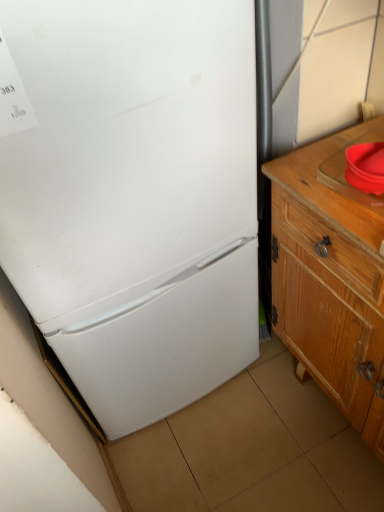
You are a GUI agent. You are given a task and a screenshot of the screen. Output one action in this format:
    pyautogui.click(x=<x>, y=<y>)
    Task: Click on the vacant space situated on the left part of red plastic sink at right
    
    Given the screenshot: What is the action you would take?
    pyautogui.click(x=318, y=189)